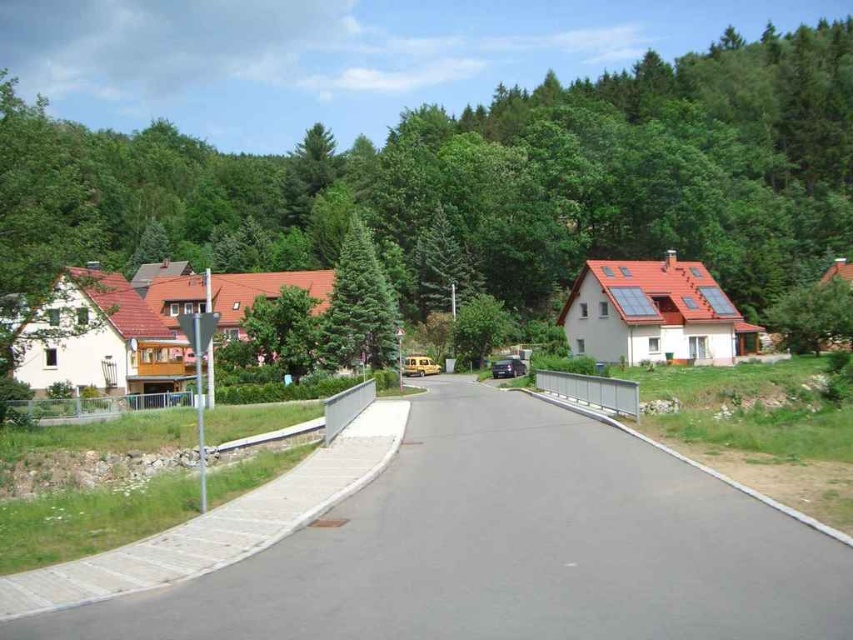
Question: Is green textured pine tree at center to the left of metallic silver car at center from the viewer's perspective?

Choices:
 (A) no
 (B) yes

Answer: (B)

Question: Is the position of green textured pine tree at center more distant than that of metallic silver car at center?

Choices:
 (A) yes
 (B) no

Answer: (B)

Question: Which object is positioned closest to the metallic silver car at center?

Choices:
 (A) green textured pine tree at center
 (B) green leafy tree at upper center

Answer: (A)

Question: Does green leafy tree at upper center appear on the left side of metallic silver car at center?

Choices:
 (A) yes
 (B) no

Answer: (B)

Question: Which point appears closest to the camera in this image?

Choices:
 (A) (496, 371)
 (B) (386, 173)
 (C) (334, 273)

Answer: (A)

Question: Among these objects, which one is nearest to the camera?

Choices:
 (A) green leafy tree at upper center
 (B) green textured pine tree at center

Answer: (A)